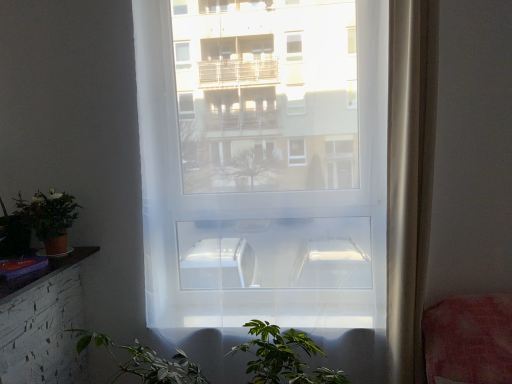
Describe the element at coordinates (50, 218) in the screenshot. I see `matte terracotta pot at lower left` at that location.

Describe the element at coordinates (409, 179) in the screenshot. Image resolution: width=512 pixels, height=384 pixels. I see `sheer white curtain at right` at that location.

Find the location of a particular element. This screenshot has height=384, width=512. sheer white curtain at right is located at coordinates (409, 179).

Describe the element at coordinates (289, 193) in the screenshot. I see `transparent plastic window at center` at that location.

The image size is (512, 384). What are the coordinates of `matte terracotta pot at lower left` in the screenshot? It's located at (50, 218).

Is transparent plastic window at center far away from sheer white curtain at right?

transparent plastic window at center is near sheer white curtain at right, not far away.

Considering the relative positions of transparent plastic window at center and sheer white curtain at right in the image provided, is transparent plastic window at center to the left or to the right of sheer white curtain at right?

Based on their positions, transparent plastic window at center is located to the left of sheer white curtain at right.

Is point (381, 119) positioned behind point (419, 378)?

Yes.

Can you confirm if transparent plastic window at center is thinner than sheer white curtain at right?

Yes, transparent plastic window at center is thinner than sheer white curtain at right.

Considering the sizes of objects matte terracotta pot at lower left and sheer white curtain at right in the image provided, who is thinner, matte terracotta pot at lower left or sheer white curtain at right?

Thinner between the two is matte terracotta pot at lower left.

Between point (30, 207) and point (390, 20), which one is positioned behind?

The point (30, 207) is more distant.

Who is taller, matte terracotta pot at lower left or sheer white curtain at right?

sheer white curtain at right is taller.

Would you say sheer white curtain at right is to the left or to the right of transparent plastic window at center in the picture?

Clearly, sheer white curtain at right is on the right of transparent plastic window at center in the image.

From a real-world perspective, is sheer white curtain at right on transparent plastic window at center?

Incorrect, from a real-world perspective, sheer white curtain at right is lower than transparent plastic window at center.

How different are the orientations of sheer white curtain at right and transparent plastic window at center in degrees?

There is a 2.67e-05-degree angle between the facing directions of sheer white curtain at right and transparent plastic window at center.

From the image's perspective, would you say sheer white curtain at right is shown under transparent plastic window at center?

Correct, sheer white curtain at right appears lower than transparent plastic window at center in the image.

Considering the relative positions of sheer white curtain at right and matte terracotta pot at lower left in the image provided, is sheer white curtain at right to the right of matte terracotta pot at lower left from the viewer's perspective?

Yes, sheer white curtain at right is to the right of matte terracotta pot at lower left.

Looking at this image, considering the sizes of sheer white curtain at right and matte terracotta pot at lower left in the image, is sheer white curtain at right taller or shorter than matte terracotta pot at lower left?

Clearly, sheer white curtain at right is taller compared to matte terracotta pot at lower left.

Based on the photo, does sheer white curtain at right turn towards matte terracotta pot at lower left?

No.

Is matte terracotta pot at lower left surrounded by sheer white curtain at right?

Definitely not — matte terracotta pot at lower left is not inside sheer white curtain at right.

In the scene shown: Which of these two, matte terracotta pot at lower left or transparent plastic window at center, is wider?

matte terracotta pot at lower left.

Considering their positions, is matte terracotta pot at lower left located in front of or behind transparent plastic window at center?

matte terracotta pot at lower left is behind transparent plastic window at center.

What are the coordinates of `window above the matte terracotta pot at lower left (from a real-world perspective)` in the screenshot? It's located at (289, 193).

Between matte terracotta pot at lower left and transparent plastic window at center, which one appears on the right side from the viewer's perspective?

transparent plastic window at center.

Is transparent plastic window at center bigger than matte terracotta pot at lower left?

Yes.

Looking at this image, considering the relative positions of transparent plastic window at center and matte terracotta pot at lower left in the image provided, is transparent plastic window at center to the left of matte terracotta pot at lower left from the viewer's perspective?

Incorrect, transparent plastic window at center is not on the left side of matte terracotta pot at lower left.

Is transparent plastic window at center not near matte terracotta pot at lower left?

No.

Find the location of a particular element. This screenshot has width=512, height=384. curtain lying below the transparent plastic window at center (from the image's perspective) is located at coordinates (409, 179).

Where is `houseplant behind the sheer white curtain at right`? This screenshot has height=384, width=512. houseplant behind the sheer white curtain at right is located at coordinates (50, 218).

Based on their spatial positions, is transparent plastic window at center or matte terracotta pot at lower left further from sheer white curtain at right?

matte terracotta pot at lower left is positioned further to the anchor sheer white curtain at right.

Estimate the real-world distances between objects in this image. Which object is further from transparent plastic window at center, matte terracotta pot at lower left or sheer white curtain at right?

matte terracotta pot at lower left is further to transparent plastic window at center.

From the picture: From the image, which object appears to be farther from sheer white curtain at right, matte terracotta pot at lower left or transparent plastic window at center?

matte terracotta pot at lower left.

From the picture: Considering their positions, is sheer white curtain at right positioned closer to matte terracotta pot at lower left than transparent plastic window at center?

transparent plastic window at center lies closer to matte terracotta pot at lower left than the other object.

Estimate the real-world distances between objects in this image. Which object is closer to transparent plastic window at center, sheer white curtain at right or matte terracotta pot at lower left?

Among the two, sheer white curtain at right is located nearer to transparent plastic window at center.

Looking at the image, which one is located further to matte terracotta pot at lower left, transparent plastic window at center or sheer white curtain at right?

sheer white curtain at right.

Locate an element on the screen. window between matte terracotta pot at lower left and sheer white curtain at right is located at coordinates (289, 193).